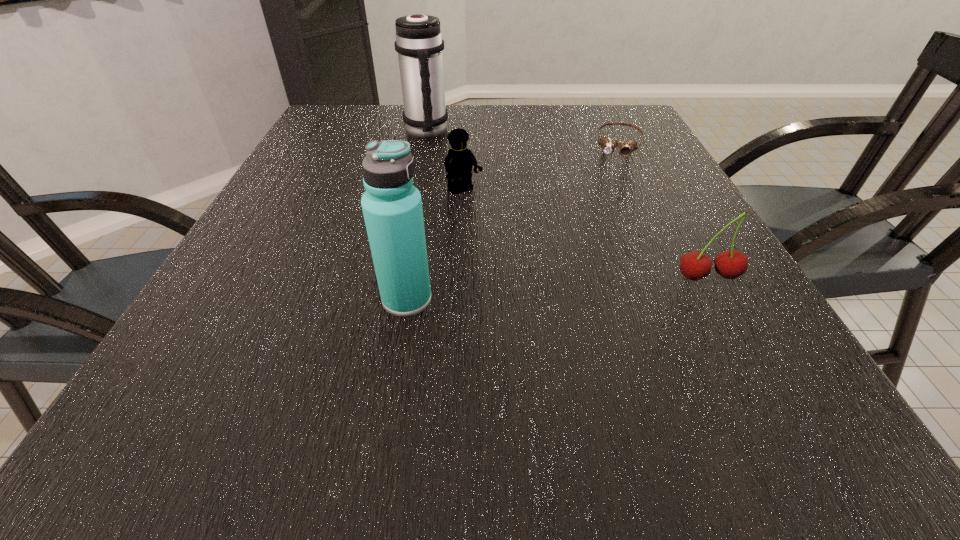
This screenshot has height=540, width=960. I want to click on blank area in the image that satisfies the following two spatial constraints: 1. on the back side of the shortest object; 2. on the left side of the third farthest object, so click(x=467, y=143).

The height and width of the screenshot is (540, 960). I want to click on free region that satisfies the following two spatial constraints: 1. on the back side of the nearer thermos bottle; 2. on the right side of the third object from left to right, so click(425, 192).

You are a GUI agent. You are given a task and a screenshot of the screen. Output one action in this format:
    pyautogui.click(x=<x>, y=<y>)
    Task: Click on the vacant region that satisfies the following two spatial constraints: 1. on the front side of the farther thermos bottle; 2. on the left side of the third object from left to right
    Image resolution: width=960 pixels, height=540 pixels.
    Given the screenshot: What is the action you would take?
    pyautogui.click(x=415, y=192)